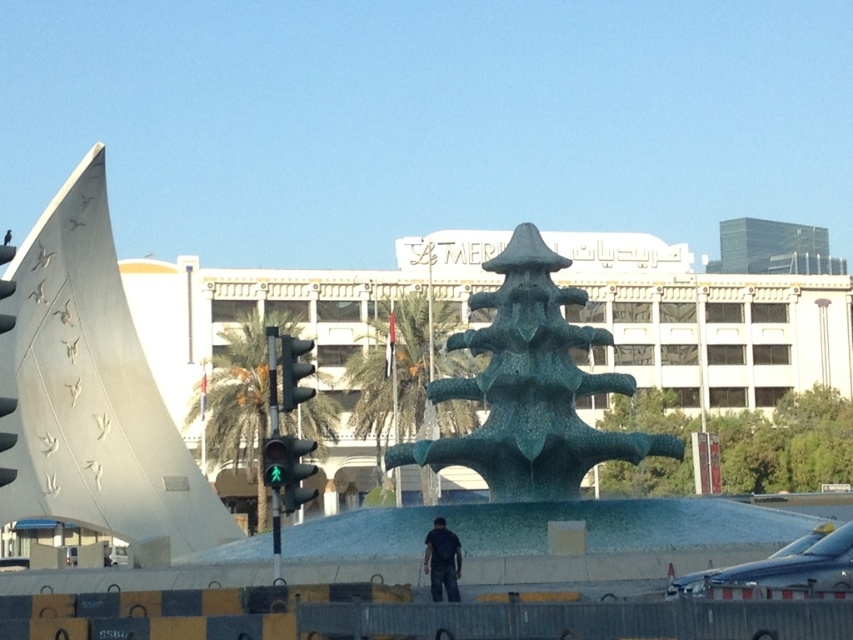
Question: Considering the relative positions of green textured fountain at center and green matte traffic light at center in the image provided, where is green textured fountain at center located with respect to green matte traffic light at center?

Choices:
 (A) below
 (B) above

Answer: (A)

Question: Is silver metallic fighter jet at lower right in front of green matte traffic light at center?

Choices:
 (A) no
 (B) yes

Answer: (B)

Question: Which object is the closest to the green matte traffic light at center?

Choices:
 (A) dark blue shirt at center
 (B) green textured fountain at center
 (C) silver metallic fighter jet at lower right

Answer: (A)

Question: Can you confirm if green textured fountain at center is positioned to the left of silver metallic fighter jet at lower right?

Choices:
 (A) no
 (B) yes

Answer: (B)

Question: Considering the real-world distances, which object is farthest from the green textured fountain at center?

Choices:
 (A) green matte traffic light at center
 (B) silver metallic fighter jet at lower right

Answer: (A)

Question: Which object appears farthest from the camera in this image?

Choices:
 (A) dark blue shirt at center
 (B) green textured fountain at center
 (C) silver metallic fighter jet at lower right
 (D) green glass pedestrian signal at center

Answer: (B)